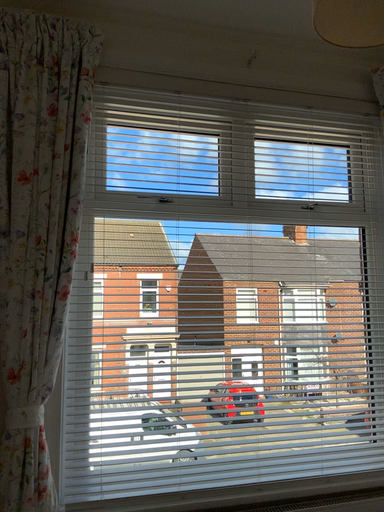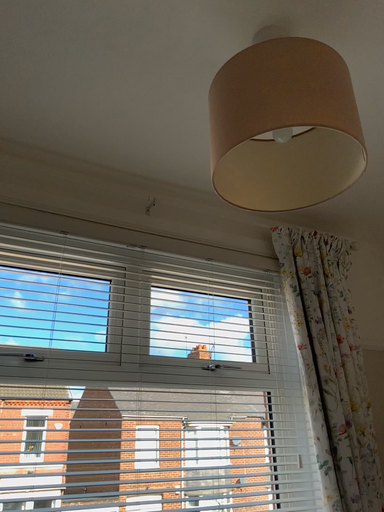
Question: Which way did the camera rotate in the video?

Choices:
 (A) rotated right
 (B) rotated left

Answer: (A)